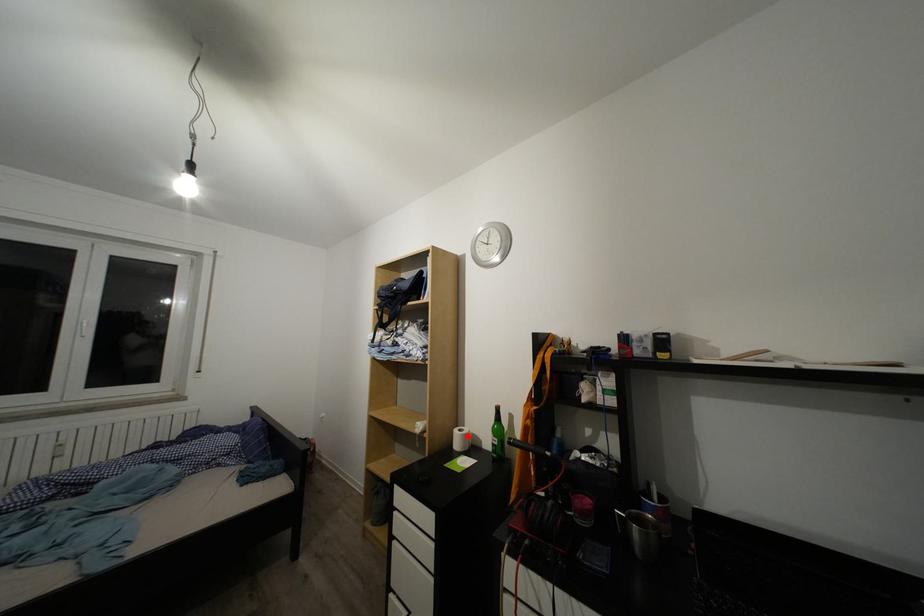
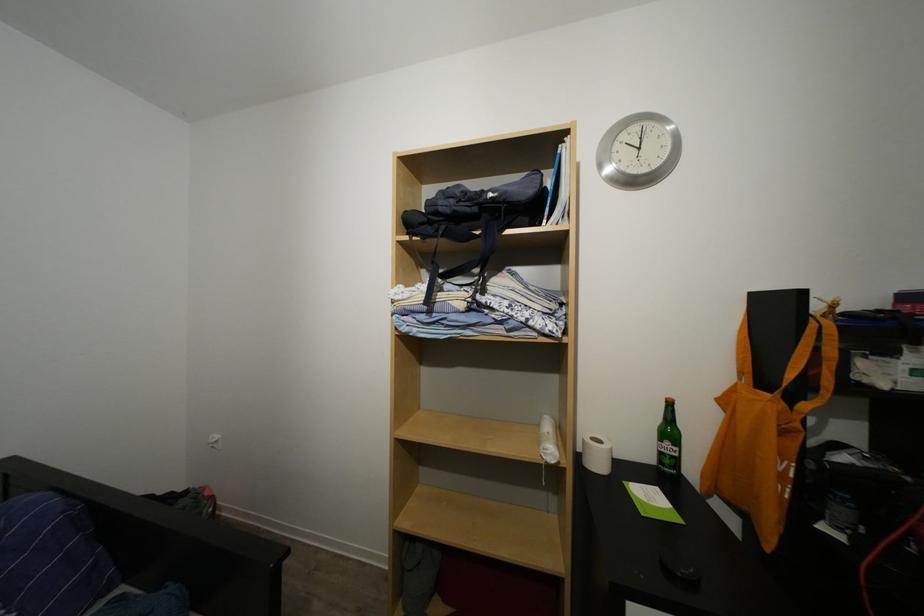
Locate, in the second image, the point that corresponds to the highlighted location in the first image.

(601, 446)